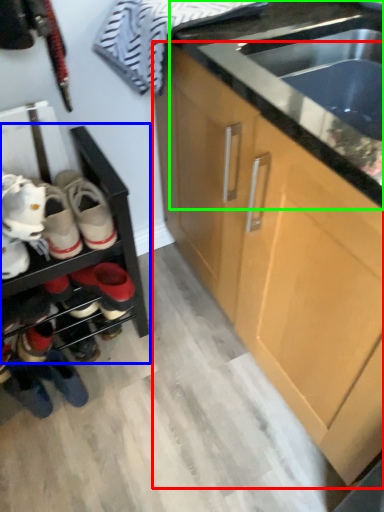
Question: Which is nearer to the cabinetry (highlighted by a red box)? shelf (highlighted by a blue box) or countertop (highlighted by a green box).

Choices:
 (A) shelf
 (B) countertop

Answer: (B)